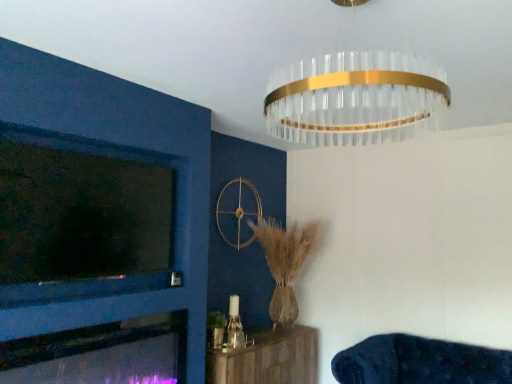
Question: Considering the positions of clear glass chandelier at upper center and matte glass fireplace at lower left in the image, is clear glass chandelier at upper center wider or thinner than matte glass fireplace at lower left?

Choices:
 (A) thin
 (B) wide

Answer: (B)

Question: Based on their sizes in the image, would you say clear glass chandelier at upper center is bigger or smaller than matte glass fireplace at lower left?

Choices:
 (A) small
 (B) big

Answer: (B)

Question: Considering the real-world distances, which object is farthest from the matte glass fireplace at lower left?

Choices:
 (A) dark blue plush couch at lower right, marked as the 2th furniture in a left-to-right arrangement
 (B) wooden shelf at lower center, placed as the 2th furniture when sorted from right to left
 (C) clear glass chandelier at upper center

Answer: (C)

Question: Which of these objects is positioned farthest from the matte glass fireplace at lower left?

Choices:
 (A) wooden shelf at lower center, which ranks as the 1th furniture in left-to-right order
 (B) dark blue plush couch at lower right, which ranks as the 1th furniture in right-to-left order
 (C) clear glass chandelier at upper center

Answer: (C)